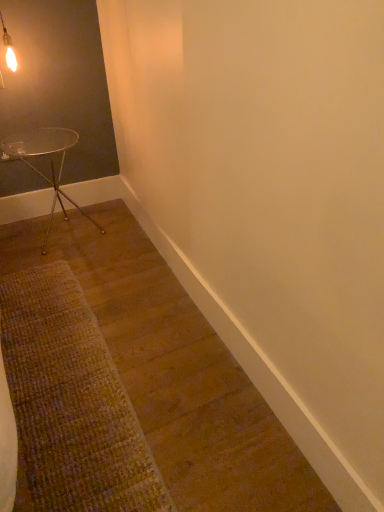
Locate an element on the screen. clear glass table at left is located at coordinates (50, 162).

Describe the element at coordinates (50, 162) in the screenshot. The height and width of the screenshot is (512, 384). I see `clear glass table at left` at that location.

At what (x,y) coordinates should I click in order to perform the action: click on clear glass table at left. Please return your answer as a coordinate pair (x, y). This screenshot has width=384, height=512. Looking at the image, I should click on (50, 162).